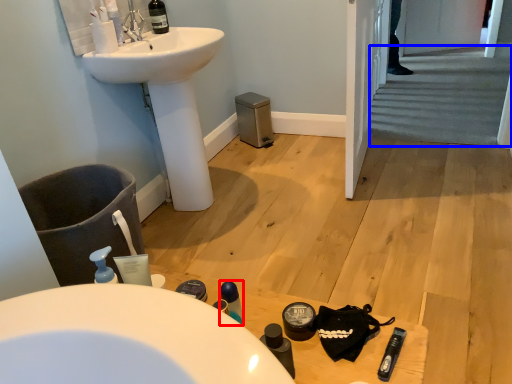
Question: Which of the following is the closest to the observer, mouthwash (highlighted by a red box) or stairs (highlighted by a blue box)?

Choices:
 (A) mouthwash
 (B) stairs

Answer: (A)